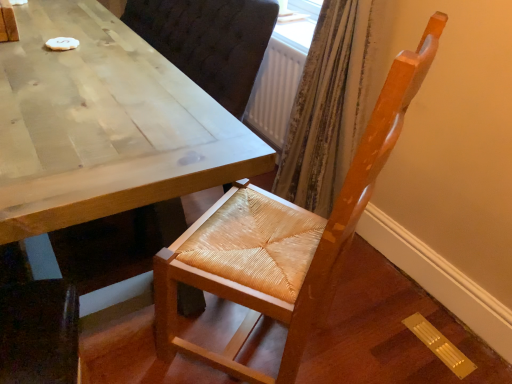
Question: In terms of height, does light brown wooden table at center look taller or shorter compared to woven wood chair at center?

Choices:
 (A) short
 (B) tall

Answer: (A)

Question: Is light brown wooden table at center in front of or behind woven wood chair at center in the image?

Choices:
 (A) front
 (B) behind

Answer: (B)

Question: Visually, is light brown wooden table at center positioned to the left or to the right of woven wood chair at center?

Choices:
 (A) right
 (B) left

Answer: (B)

Question: Visually, is woven wood chair at center positioned to the left or to the right of light brown wooden table at center?

Choices:
 (A) right
 (B) left

Answer: (A)

Question: Is woven wood chair at center in front of or behind light brown wooden table at center in the image?

Choices:
 (A) front
 (B) behind

Answer: (A)

Question: Do you think woven wood chair at center is within light brown wooden table at center, or outside of it?

Choices:
 (A) inside
 (B) outside

Answer: (B)

Question: Does point (225, 248) appear closer or farther from the camera than point (14, 52)?

Choices:
 (A) closer
 (B) farther

Answer: (A)